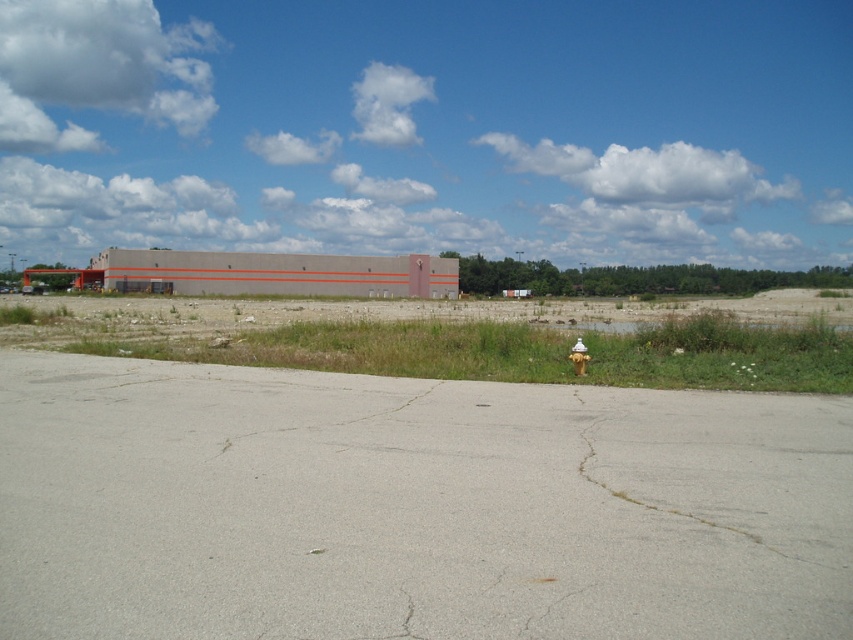
Which is above, gray cracked asphalt at center or yellow metallic hydrant at center?

yellow metallic hydrant at center is above.

Between point (358, 417) and point (583, 369), which one is positioned in front?

Point (358, 417) is more forward.

You are a GUI agent. You are given a task and a screenshot of the screen. Output one action in this format:
    pyautogui.click(x=<x>, y=<y>)
    Task: Click on the gray cracked asphalt at center
    Image resolution: width=853 pixels, height=640 pixels.
    Given the screenshot: What is the action you would take?
    pyautogui.click(x=315, y=406)